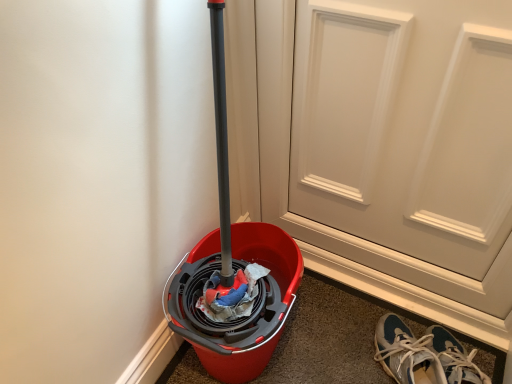
Question: Is blue suede sneakers at lower right to the left or to the right of white matte door at center in the image?

Choices:
 (A) left
 (B) right

Answer: (B)

Question: Considering the positions of point (386, 362) and point (369, 61), is point (386, 362) closer or farther from the camera than point (369, 61)?

Choices:
 (A) farther
 (B) closer

Answer: (A)

Question: From a real-world perspective, is blue suede sneakers at lower right above or below white matte door at center?

Choices:
 (A) above
 (B) below

Answer: (B)

Question: Is white matte door at center to the left or to the right of blue suede sneakers at lower right in the image?

Choices:
 (A) left
 (B) right

Answer: (A)

Question: Considering the positions of white matte door at center and blue suede sneakers at lower right in the image, is white matte door at center wider or thinner than blue suede sneakers at lower right?

Choices:
 (A) wide
 (B) thin

Answer: (B)

Question: Looking at the image, does white matte door at center seem bigger or smaller compared to blue suede sneakers at lower right?

Choices:
 (A) small
 (B) big

Answer: (B)

Question: From a real-world perspective, relative to blue suede sneakers at lower right, is white matte door at center vertically above or below?

Choices:
 (A) above
 (B) below

Answer: (A)